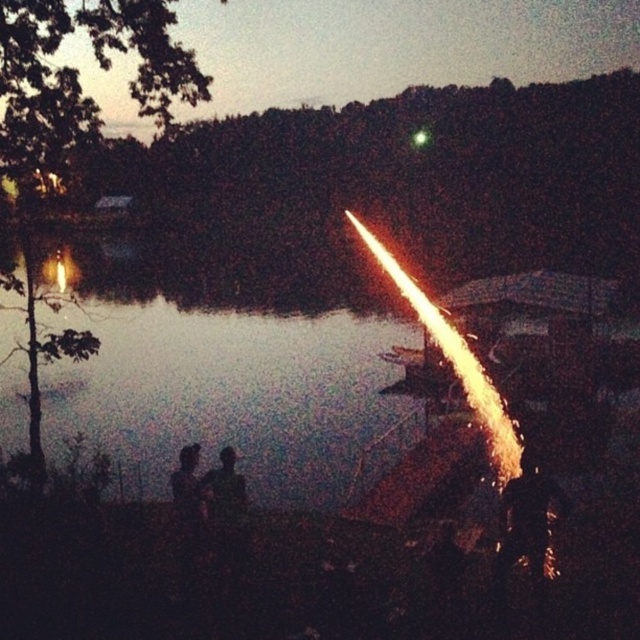
You are standing at the lakeside and see the transparent water at center and the black matte person at lower center. Which object takes up more space in the image?

The transparent water at center takes up more space in the image because it has a larger size compared to the black matte person at lower center.